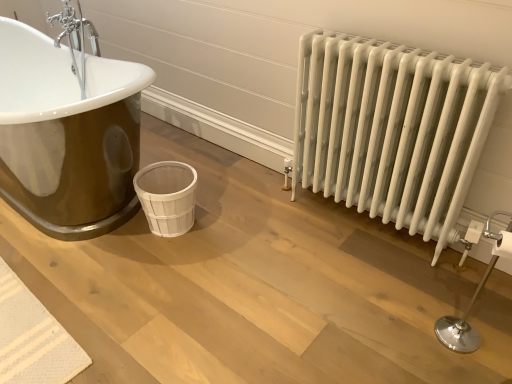
Where is `vacant space in front of white painted metal radiator at right`? vacant space in front of white painted metal radiator at right is located at coordinates (373, 299).